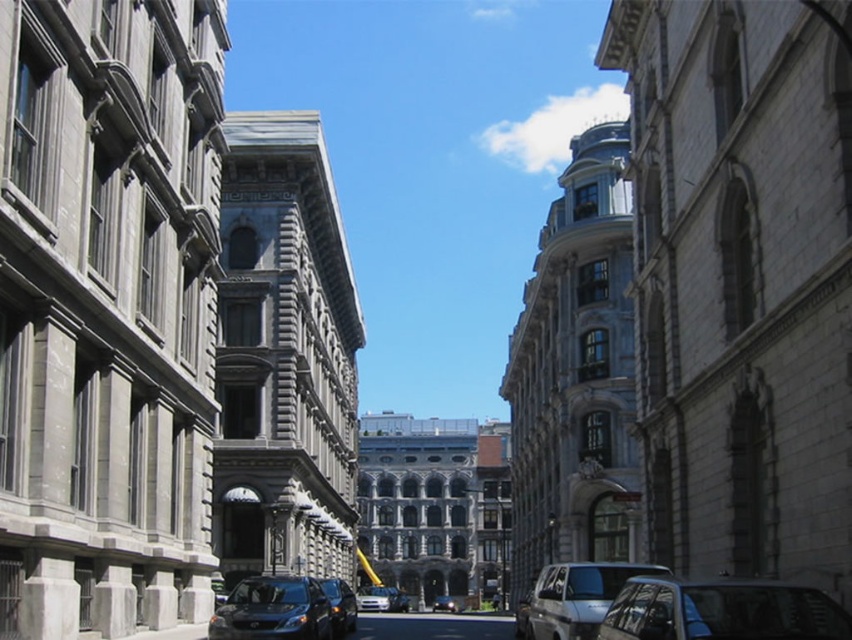
Question: Which object is the closest to the shiny black van at center?

Choices:
 (A) shiny black car at center
 (B) metallic blue van at lower center

Answer: (B)

Question: Can you confirm if metallic blue van at lower center is bigger than white glossy car at center?

Choices:
 (A) no
 (B) yes

Answer: (A)

Question: Which of these objects is positioned closest to the metallic blue van at lower center?

Choices:
 (A) white glossy car at center
 (B) shiny black van at center
 (C) metallic silver car at lower right
 (D) silver metallic van at center

Answer: (B)

Question: Is metallic blue van at lower center positioned behind white glossy car at center?

Choices:
 (A) no
 (B) yes

Answer: (A)

Question: Based on their relative distances, which object is nearer to the silver metallic van at center?

Choices:
 (A) shiny black van at center
 (B) white glossy car at center

Answer: (A)

Question: Is metallic silver car at lower right smaller than shiny black van at center?

Choices:
 (A) no
 (B) yes

Answer: (B)